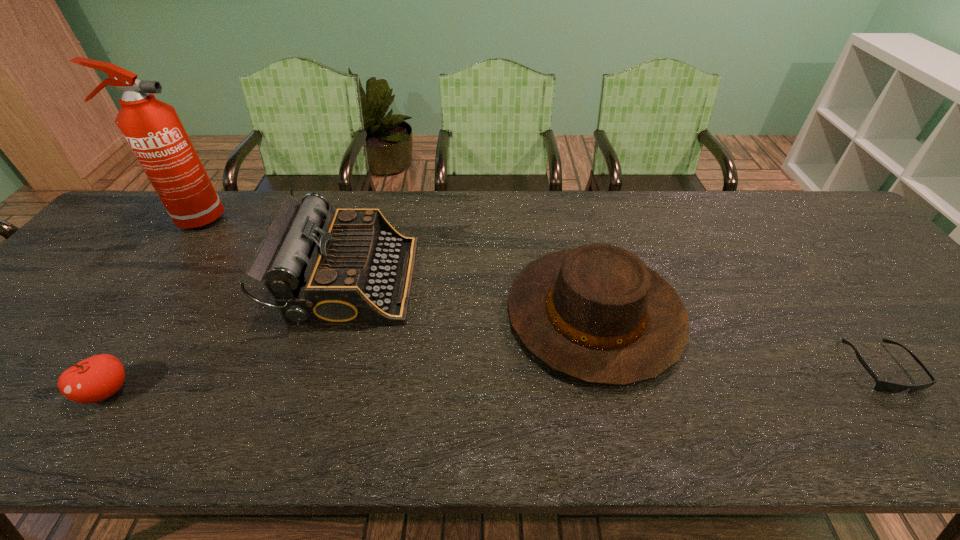
What are the coordinates of `vacant position located on the keyboard of the typewriter` in the screenshot? It's located at (508, 280).

The image size is (960, 540). I want to click on vacant region located 0.080m on the right of the fourth object from left to right, so click(714, 314).

The width and height of the screenshot is (960, 540). Identify the location of vacant position located on the right of the fourth tallest object. (258, 391).

Find the location of `vacant space located on the front-facing side of the shortest object`. vacant space located on the front-facing side of the shortest object is located at coordinates (936, 442).

Locate an element on the screen. fire extinguisher present at the far edge is located at coordinates (152, 128).

You are a GUI agent. You are given a task and a screenshot of the screen. Output one action in this format:
    pyautogui.click(x=<x>, y=<y>)
    Task: Click on the typewriter located at the far edge
    
    Given the screenshot: What is the action you would take?
    pyautogui.click(x=350, y=266)

This screenshot has width=960, height=540. What are the coordinates of `object situated at the near edge` in the screenshot? It's located at tap(94, 379).

Where is `object that is at the left edge`? This screenshot has width=960, height=540. object that is at the left edge is located at coordinates (152, 128).

Find the location of `object that is at the right edge`. object that is at the right edge is located at coordinates (883, 386).

At what (x,y) coordinates should I click in order to perform the action: click on object at the far left corner. Please return your answer as a coordinate pair (x, y). The width and height of the screenshot is (960, 540). Looking at the image, I should click on (152, 128).